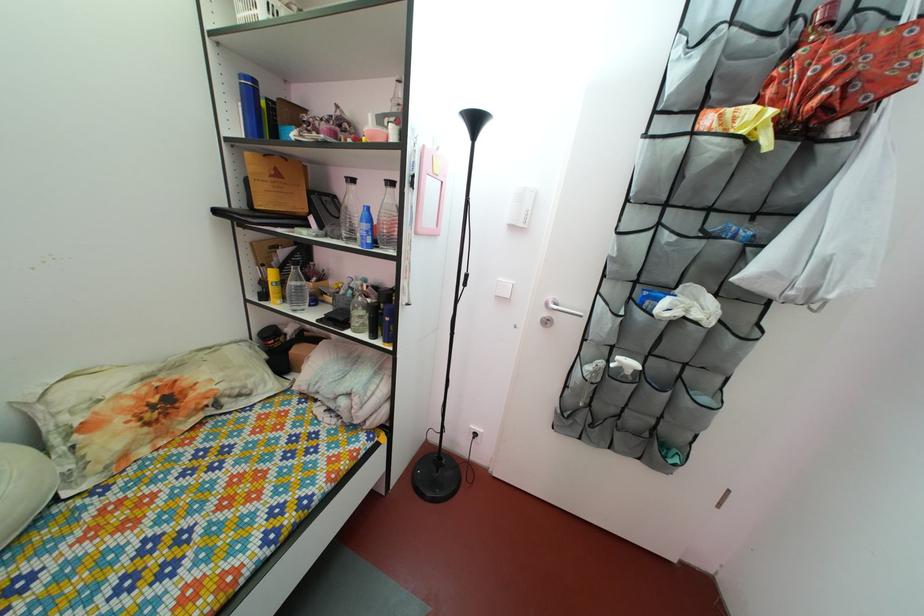
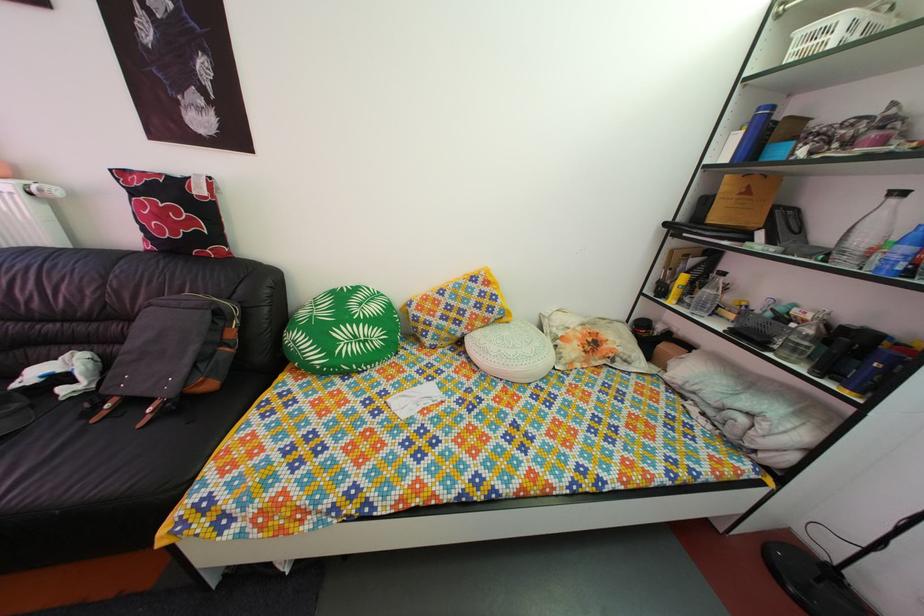
Question: How did the camera likely rotate?

Choices:
 (A) Left
 (B) Right
 (C) Up
 (D) Down

Answer: (A)